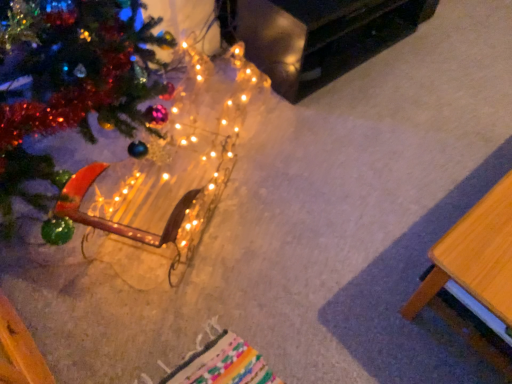
Question: Does wooden table at lower right, marked as the second table in a back-to-front arrangement, have a smaller size compared to black glossy table at upper right, which is the first table in top-to-bottom order?

Choices:
 (A) yes
 (B) no

Answer: (A)

Question: Is wooden table at lower right, which is counted as the first table, starting from the bottom, turned away from black glossy table at upper right, which is counted as the 2th table, starting from the bottom?

Choices:
 (A) yes
 (B) no

Answer: (B)

Question: From the image's perspective, is wooden table at lower right, marked as the 1th table in a front-to-back arrangement, above black glossy table at upper right, which is the first table in top-to-bottom order?

Choices:
 (A) no
 (B) yes

Answer: (A)

Question: Is wooden table at lower right, which is counted as the first table, starting from the bottom, thinner than black glossy table at upper right, the second table in the front-to-back sequence?

Choices:
 (A) yes
 (B) no

Answer: (A)

Question: Considering the relative sizes of wooden table at lower right, marked as the second table in a back-to-front arrangement, and black glossy table at upper right, which is the first table in back-to-front order, in the image provided, is wooden table at lower right, marked as the second table in a back-to-front arrangement, wider than black glossy table at upper right, which is the first table in back-to-front order,?

Choices:
 (A) yes
 (B) no

Answer: (B)

Question: Is black glossy table at upper right, which is the first table in back-to-front order, taller or shorter than wooden table at lower right, marked as the 1th table in a front-to-back arrangement?

Choices:
 (A) tall
 (B) short

Answer: (B)

Question: Based on their positions, is black glossy table at upper right, the second table in the front-to-back sequence, located to the left or right of wooden table at lower right, marked as the second table in a back-to-front arrangement?

Choices:
 (A) right
 (B) left

Answer: (B)

Question: From a real-world perspective, relative to wooden table at lower right, marked as the second table in a back-to-front arrangement, is black glossy table at upper right, the second table in the front-to-back sequence, vertically above or below?

Choices:
 (A) above
 (B) below

Answer: (A)

Question: Considering their positions, is black glossy table at upper right, which is the first table in top-to-bottom order, located in front of or behind wooden table at lower right, arranged as the 2th table when viewed from the top?

Choices:
 (A) behind
 (B) front

Answer: (A)

Question: Is wooden table at lower right, which is counted as the first table, starting from the bottom, wider or thinner than illuminated wireframe horse at lower left?

Choices:
 (A) wide
 (B) thin

Answer: (B)

Question: Is wooden table at lower right, arranged as the 2th table when viewed from the top, spatially inside illuminated wireframe horse at lower left, or outside of it?

Choices:
 (A) outside
 (B) inside

Answer: (A)

Question: Considering the relative positions of wooden table at lower right, marked as the 1th table in a front-to-back arrangement, and illuminated wireframe horse at lower left in the image provided, is wooden table at lower right, marked as the 1th table in a front-to-back arrangement, to the left or to the right of illuminated wireframe horse at lower left?

Choices:
 (A) left
 (B) right

Answer: (B)

Question: In the image, is wooden table at lower right, which is counted as the first table, starting from the bottom, positioned in front of or behind illuminated wireframe horse at lower left?

Choices:
 (A) front
 (B) behind

Answer: (A)

Question: In terms of height, does illuminated wireframe horse at lower left look taller or shorter compared to wooden table at lower right, which is counted as the first table, starting from the bottom?

Choices:
 (A) short
 (B) tall

Answer: (A)

Question: Visually, is illuminated wireframe horse at lower left positioned to the left or to the right of wooden table at lower right, marked as the 1th table in a front-to-back arrangement?

Choices:
 (A) left
 (B) right

Answer: (A)